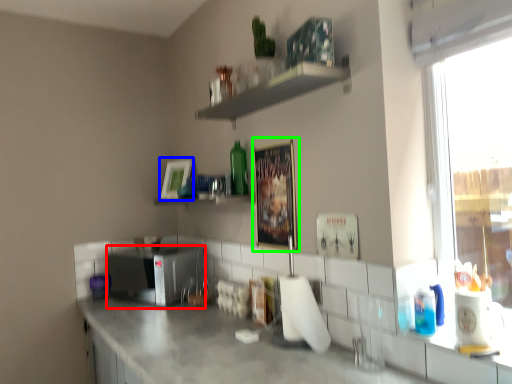
Question: Based on their relative distances, which object is nearer to appliance (highlighted by a red box)? Choose from picture frame (highlighted by a blue box) and picture frame (highlighted by a green box).

Choices:
 (A) picture frame
 (B) picture frame

Answer: (A)